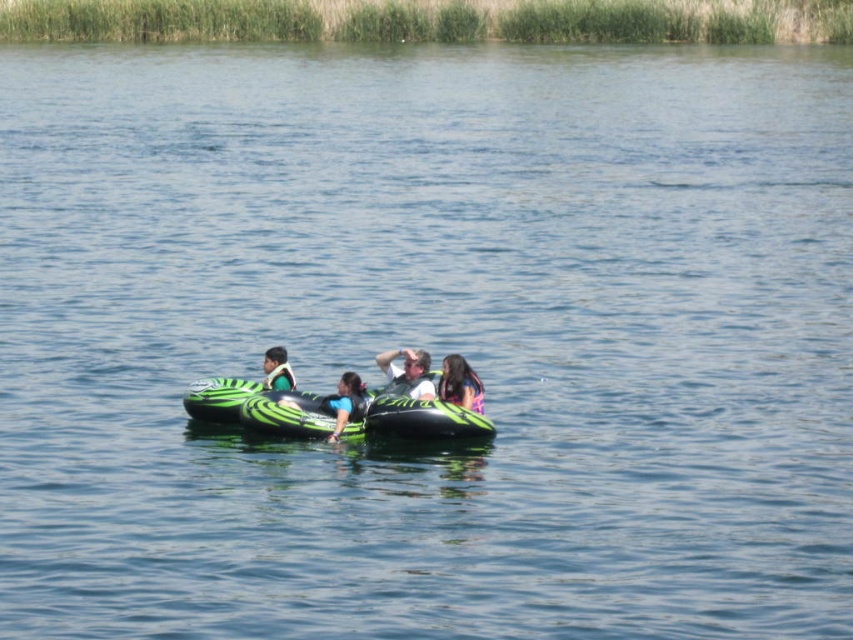
Based on the photo, you are navigating a small boat and need to avoid hitting the green inflatable tube at center. What is the safest direction to steer your boat to avoid it?

The green inflatable tube at center is located at point (x=253, y=406), so steering the boat away from that coordinate would be safest.

You are a photographer trying to capture a clear shot of the blue fabric life vest at center without the multicolored fabric hair at center blocking it. Based on their positions, can you move the life vest forward to be in front of the hair?

The blue fabric life vest at center is currently behind the multicolored fabric hair at center. To avoid obstruction, you would need to move the life vest forward so it is in front of the multicolored fabric hair at center.